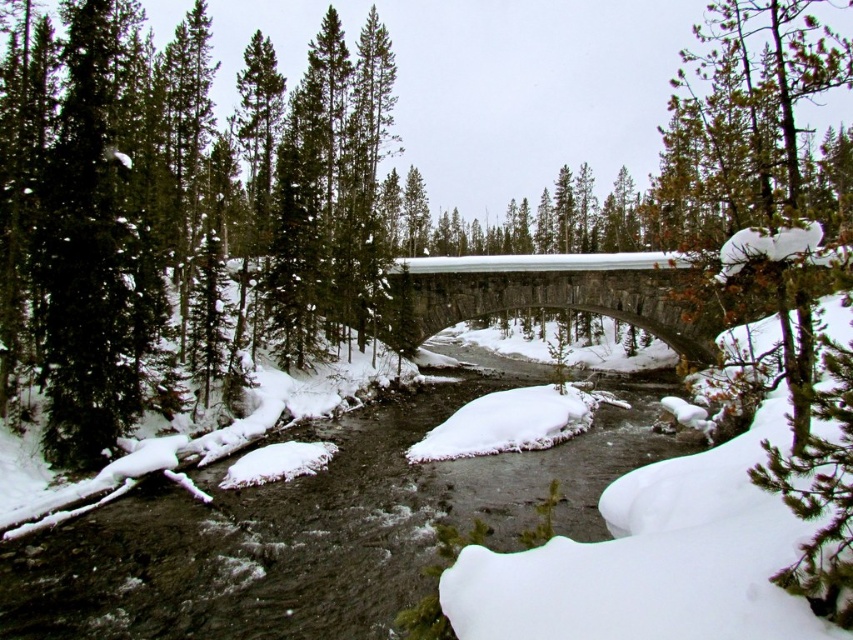
Question: Which point is farther to the camera?

Choices:
 (A) (445, 298)
 (B) (126, 300)

Answer: (A)

Question: Does green matte tree at left come in front of gray stone bridge at center?

Choices:
 (A) yes
 (B) no

Answer: (B)

Question: Does green matte tree at left have a smaller size compared to gray stone bridge at center?

Choices:
 (A) no
 (B) yes

Answer: (A)

Question: Can you confirm if green matte tree at left is wider than gray stone bridge at center?

Choices:
 (A) yes
 (B) no

Answer: (A)